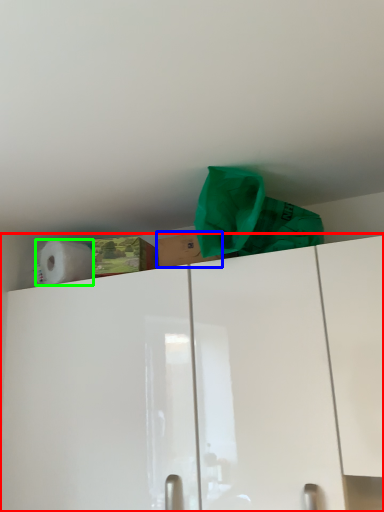
Question: Based on their relative distances, which object is nearer to cabinetry (highlighted by a red box)? Choose from cardboard box (highlighted by a blue box) and paper towel (highlighted by a green box).

Choices:
 (A) cardboard box
 (B) paper towel

Answer: (A)